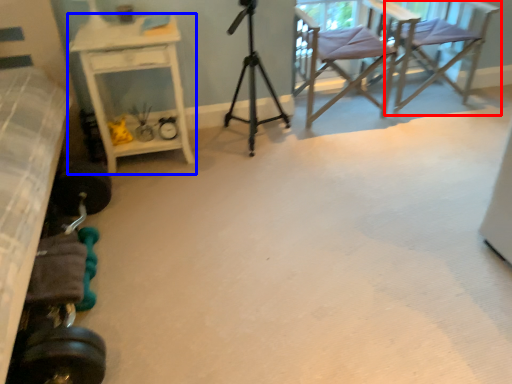
Question: Which object appears farthest to the camera in this image, chair (highlighted by a red box) or desk (highlighted by a blue box)?

Choices:
 (A) chair
 (B) desk

Answer: (A)